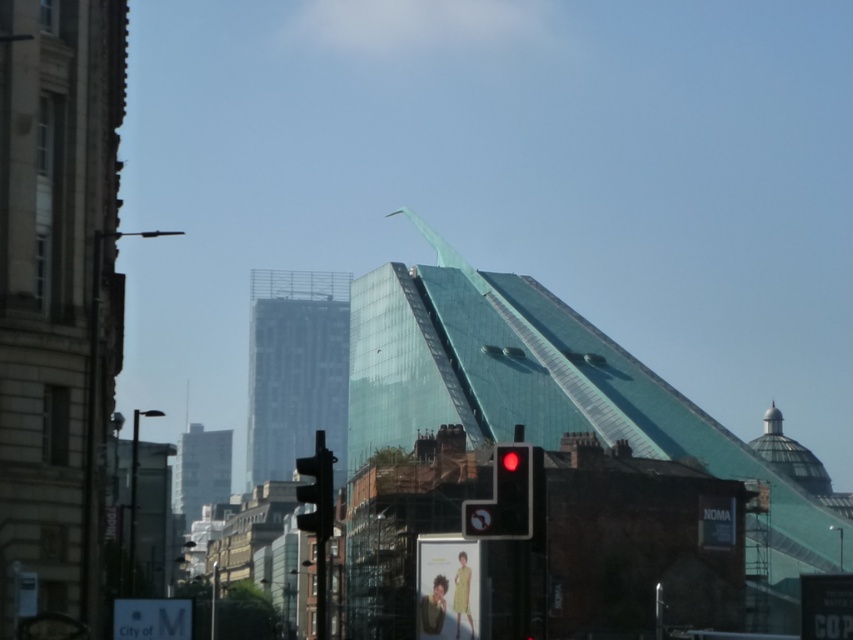
Question: Considering the real-world distances, which object is closest to the black plastic traffic light at center?

Choices:
 (A) matte black traffic light at center
 (B) red glass traffic light at center

Answer: (B)

Question: Estimate the real-world distances between objects in this image. Which object is closer to the red glass traffic light at center?

Choices:
 (A) black plastic traffic light at center
 (B) matte black traffic light at center

Answer: (B)

Question: Is matte black traffic light at center bigger than red glass traffic light at center?

Choices:
 (A) no
 (B) yes

Answer: (B)

Question: Is red glass traffic light at center below black plastic traffic light at center?

Choices:
 (A) no
 (B) yes

Answer: (A)

Question: Which point appears farthest from the camera in this image?

Choices:
 (A) (491, 534)
 (B) (332, 504)

Answer: (A)

Question: Does red glass traffic light at center have a lesser width compared to black plastic traffic light at center?

Choices:
 (A) yes
 (B) no

Answer: (A)